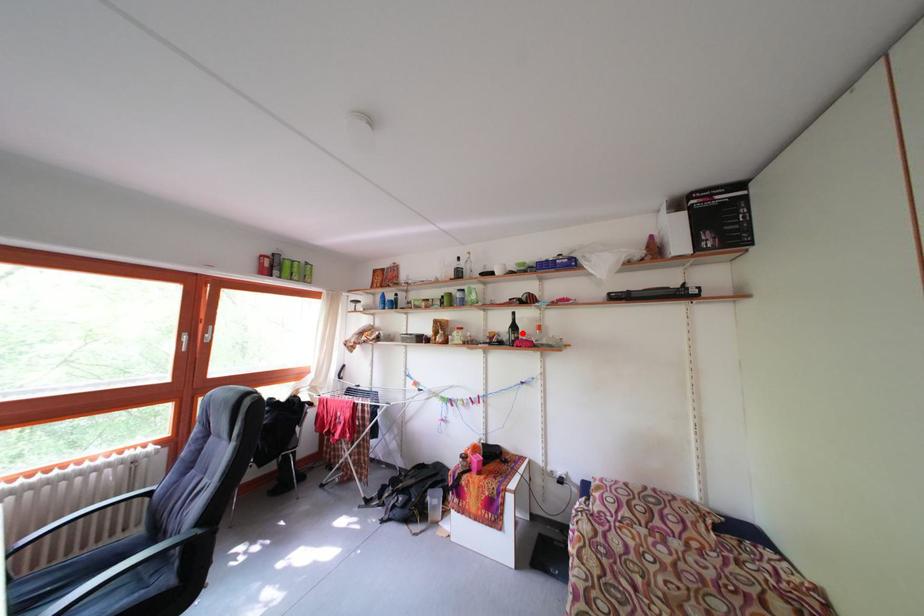
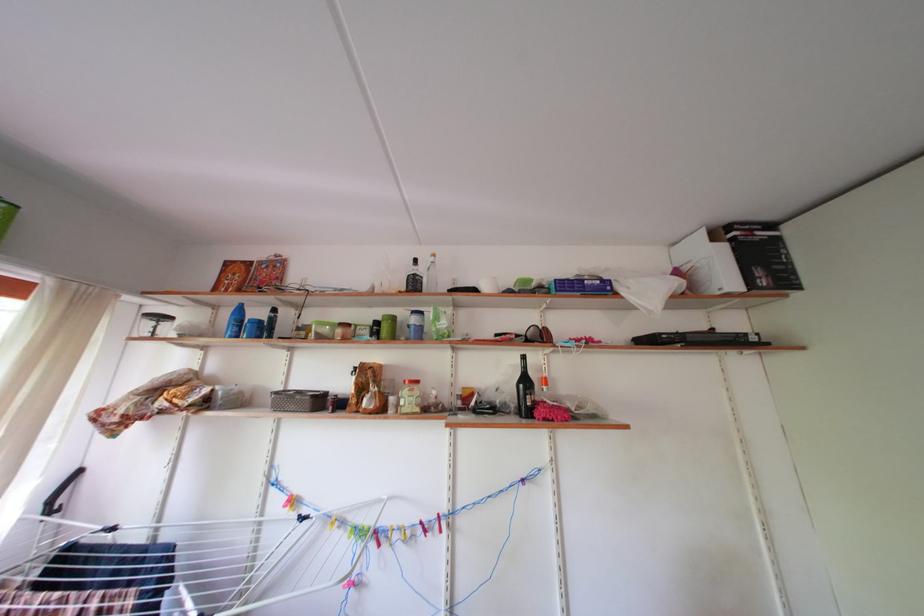
Locate, in the second image, the point that corresponds to the highlighted location in the first image.

(533, 387)